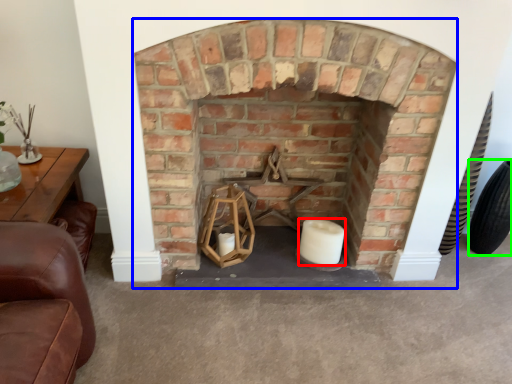
Question: Considering the real-world distances, which object is closest to candle (highlighted by a red box)? fireplace (highlighted by a blue box) or tire (highlighted by a green box).

Choices:
 (A) fireplace
 (B) tire

Answer: (A)